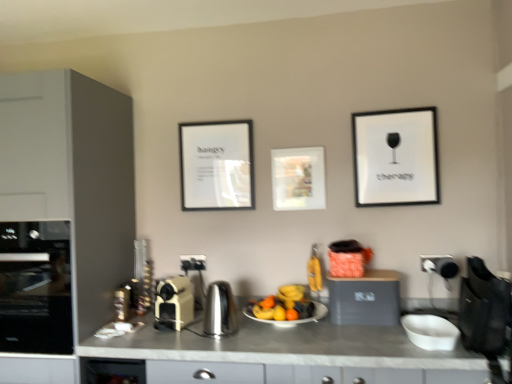
Question: Should I look upward or downward to see metallic stainless steel countertop at center?

Choices:
 (A) up
 (B) down

Answer: (B)

Question: Is matte gray cabinet at left, arranged as the second cabinetry when ordered from the bottom, oriented towards metallic stainless steel countertop at center?

Choices:
 (A) no
 (B) yes

Answer: (A)

Question: From the image's perspective, would you say matte gray cabinet at left, arranged as the second cabinetry when ordered from the bottom, is positioned over metallic stainless steel countertop at center?

Choices:
 (A) yes
 (B) no

Answer: (A)

Question: Is matte gray cabinet at left, which is the second cabinetry from right to left, bigger than metallic stainless steel countertop at center?

Choices:
 (A) no
 (B) yes

Answer: (B)

Question: From a real-world perspective, is matte gray cabinet at left, arranged as the second cabinetry when ordered from the bottom, below metallic stainless steel countertop at center?

Choices:
 (A) no
 (B) yes

Answer: (A)

Question: Is matte gray cabinet at left, the 1th cabinetry in the left-to-right sequence, at the left side of metallic stainless steel countertop at center?

Choices:
 (A) yes
 (B) no

Answer: (A)

Question: Considering the relative sizes of matte gray cabinet at left, acting as the first cabinetry starting from the top, and metallic stainless steel countertop at center in the image provided, is matte gray cabinet at left, acting as the first cabinetry starting from the top, shorter than metallic stainless steel countertop at center?

Choices:
 (A) yes
 (B) no

Answer: (B)

Question: Is matte gray cabinet at left, the 1th cabinetry in the left-to-right sequence, facing towards matte black toaster at center, the 1th electric outlet in the left-to-right sequence?

Choices:
 (A) no
 (B) yes

Answer: (A)

Question: Are matte gray cabinet at left, the 1th cabinetry in the left-to-right sequence, and matte black toaster at center, positioned as the 2th electric outlet in front-to-back order, making contact?

Choices:
 (A) yes
 (B) no

Answer: (B)

Question: Can you confirm if matte gray cabinet at left, which is the second cabinetry from right to left, is positioned to the left of matte black toaster at center, marked as the first electric outlet in a back-to-front arrangement?

Choices:
 (A) no
 (B) yes

Answer: (B)

Question: Does matte gray cabinet at left, acting as the first cabinetry starting from the top, have a larger size compared to matte black toaster at center, marked as the first electric outlet in a back-to-front arrangement?

Choices:
 (A) no
 (B) yes

Answer: (B)

Question: Is matte gray cabinet at left, acting as the first cabinetry starting from the top, taller than matte black toaster at center, positioned as the 2th electric outlet in front-to-back order?

Choices:
 (A) no
 (B) yes

Answer: (B)

Question: From a real-world perspective, is matte gray cabinet at left, acting as the first cabinetry starting from the top, located higher than matte black toaster at center, the 1th electric outlet in the left-to-right sequence?

Choices:
 (A) no
 (B) yes

Answer: (B)

Question: Considering the relative positions of white glossy plate at center and white matte bowl at lower right in the image provided, is white glossy plate at center to the left of white matte bowl at lower right from the viewer's perspective?

Choices:
 (A) no
 (B) yes

Answer: (B)